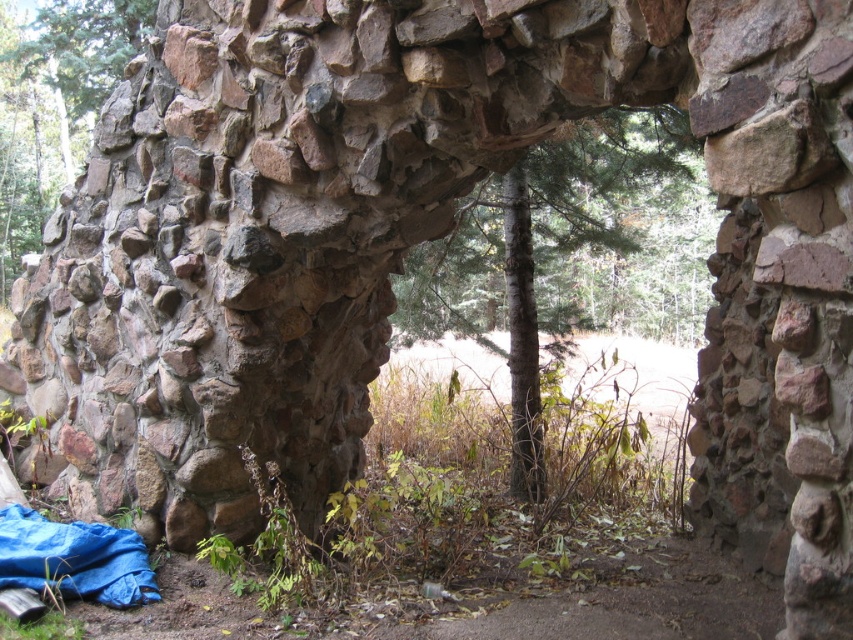
Can you confirm if green textured tree at center is wider than rustic stone wall at center?

Indeed, green textured tree at center has a greater width compared to rustic stone wall at center.

Which of these two, green textured tree at center or rustic stone wall at center, stands taller?

rustic stone wall at center

Measure the distance between green textured tree at center and camera.

They are 2.24 meters apart.

Where is `green textured tree at center`? green textured tree at center is located at coordinates (566, 257).